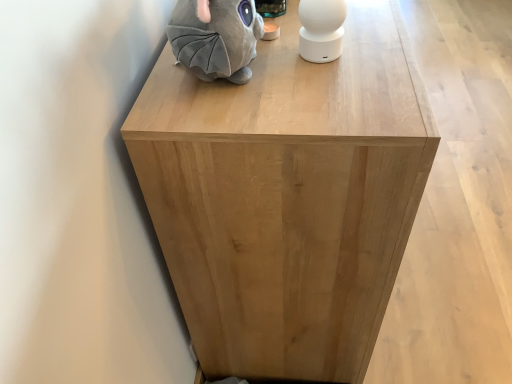
Question: Considering the relative positions of gray plush toy at upper left, marked as the 2th toy in a right-to-left arrangement, and white matte speaker at upper center, which is counted as the first toy, starting from the right, in the image provided, is gray plush toy at upper left, marked as the 2th toy in a right-to-left arrangement, to the left or to the right of white matte speaker at upper center, which is counted as the first toy, starting from the right,?

Choices:
 (A) right
 (B) left

Answer: (B)

Question: Is point (181, 38) positioned closer to the camera than point (305, 36)?

Choices:
 (A) closer
 (B) farther

Answer: (A)

Question: Estimate the real-world distances between objects in this image. Which object is farther from the white matte speaker at upper center, which is counted as the first toy, starting from the right?

Choices:
 (A) natural wood cabinet at center
 (B) gray plush toy at upper left, the first toy viewed from the left

Answer: (A)

Question: Which object is the closest to the white matte speaker at upper center, the second toy positioned from the left?

Choices:
 (A) gray plush toy at upper left, marked as the 2th toy in a right-to-left arrangement
 (B) natural wood cabinet at center

Answer: (A)